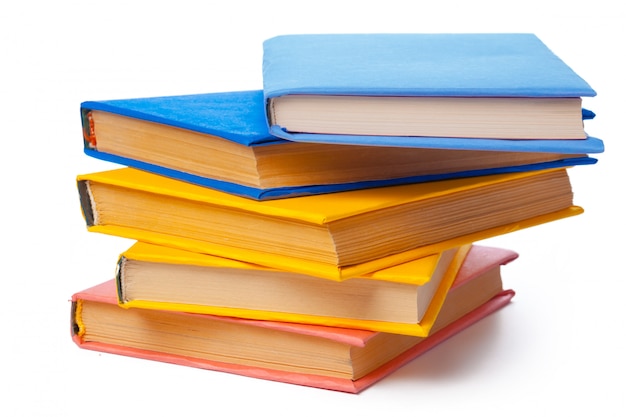
At what (x,y) coordinates should I click in order to perform the action: click on books. Please return your answer as a coordinate pair (x, y). The width and height of the screenshot is (626, 417). Looking at the image, I should click on (202, 351), (221, 279), (248, 221), (331, 108), (235, 160).